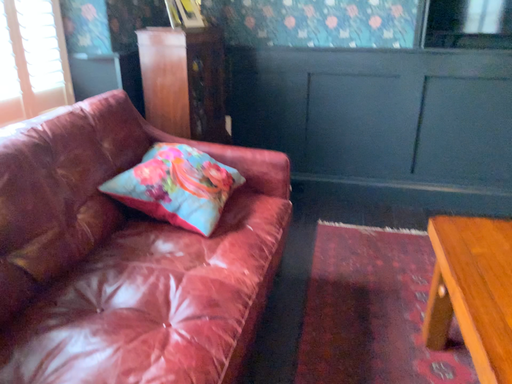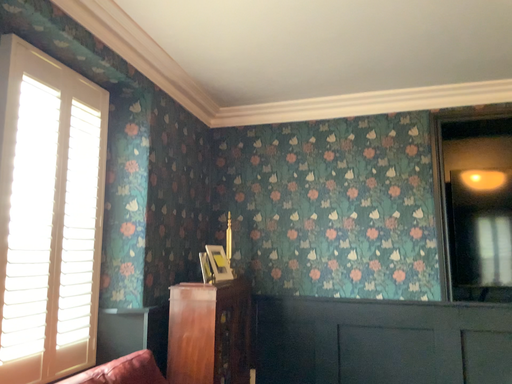
Question: Which way did the camera rotate in the video?

Choices:
 (A) rotated upward
 (B) rotated downward

Answer: (A)